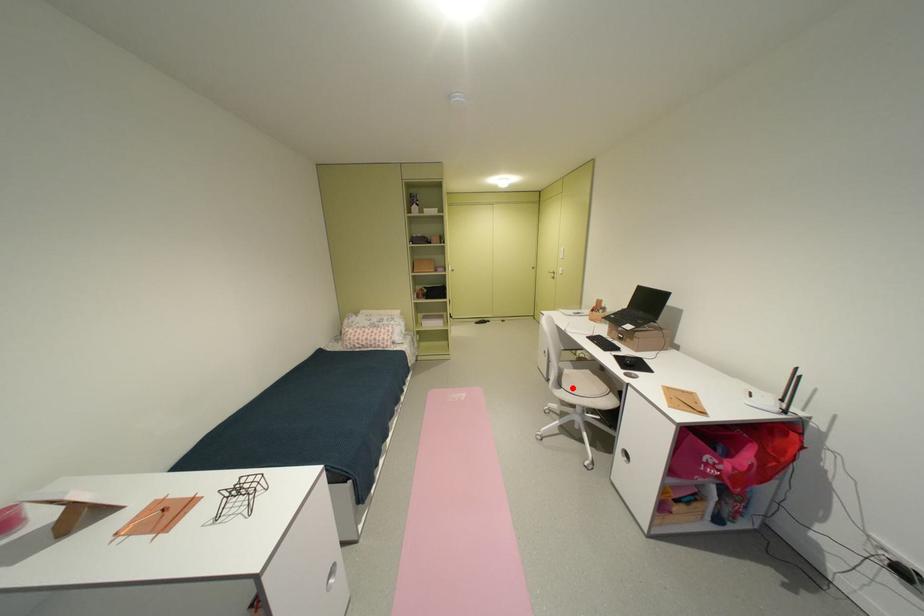
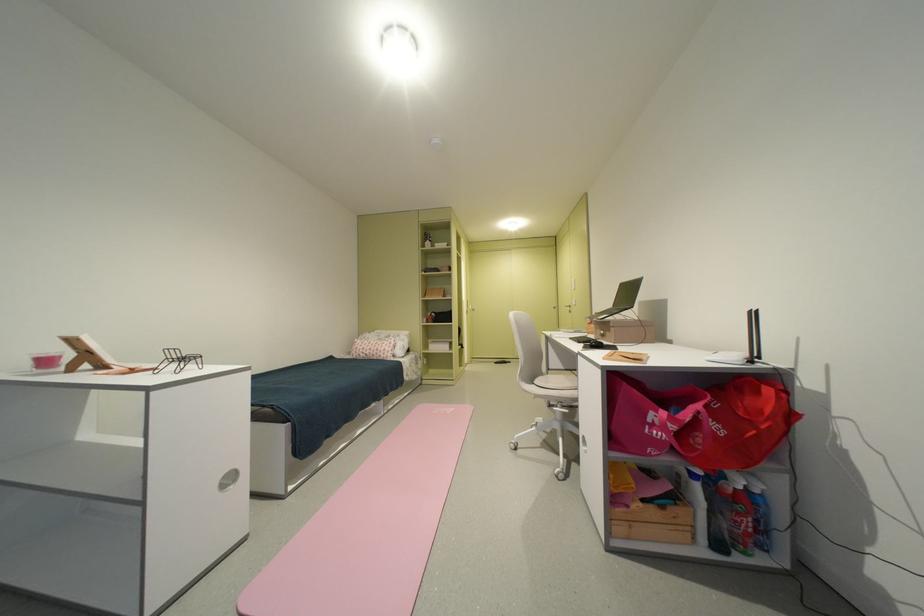
The point at the highlighted location is marked in the first image. Where is the corresponding point in the second image?

(543, 383)